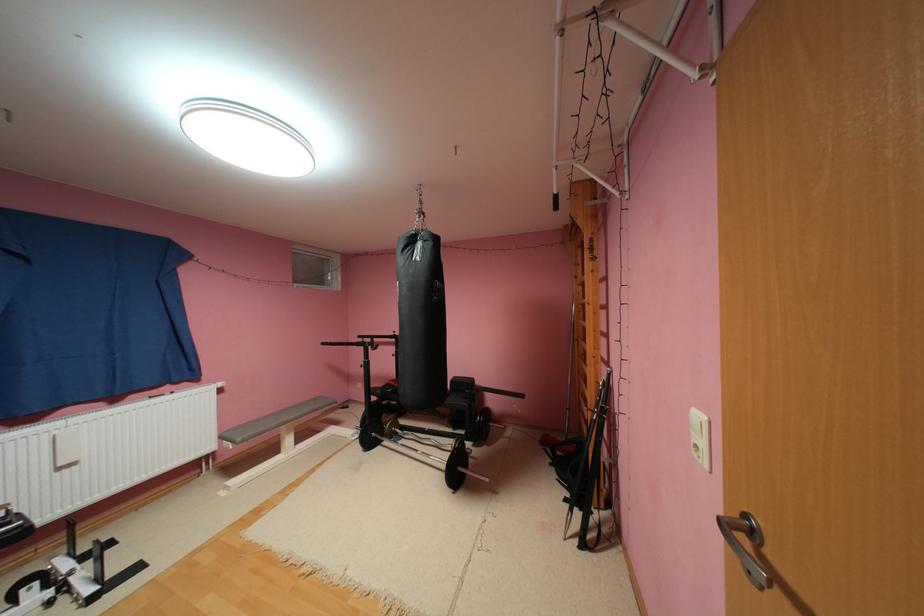
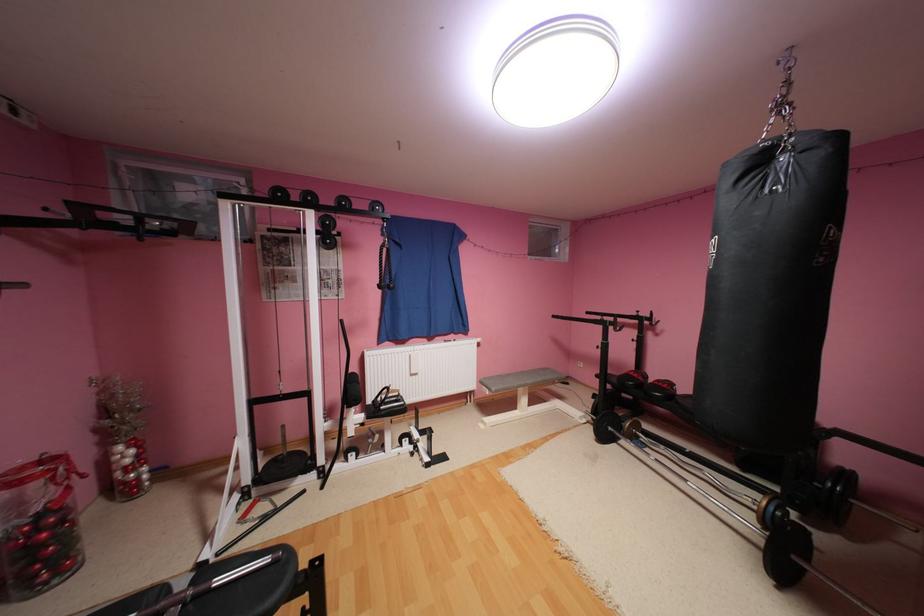
Where in the second image is the point corresponding to point 420,240 from the first image?

(769, 161)